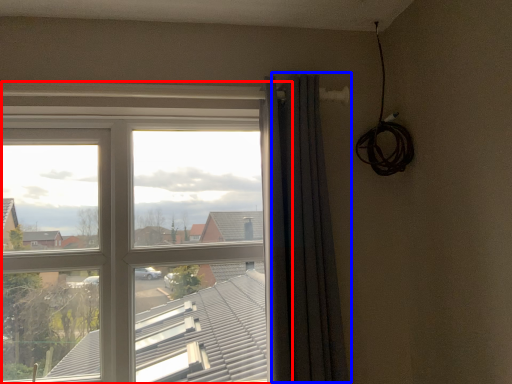
Question: Which point is further to the camera, window (highlighted by a red box) or curtain (highlighted by a blue box)?

Choices:
 (A) window
 (B) curtain

Answer: (A)